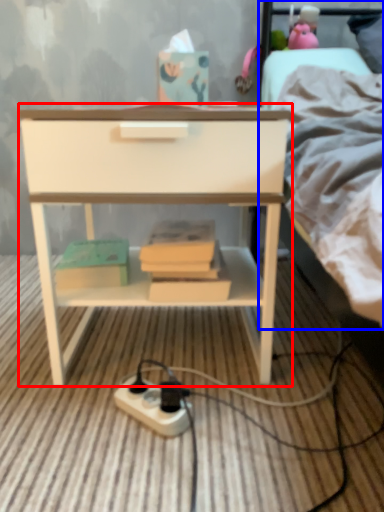
Question: Which object is closer to the camera taking this photo, nightstand (highlighted by a red box) or bed (highlighted by a blue box)?

Choices:
 (A) nightstand
 (B) bed

Answer: (A)